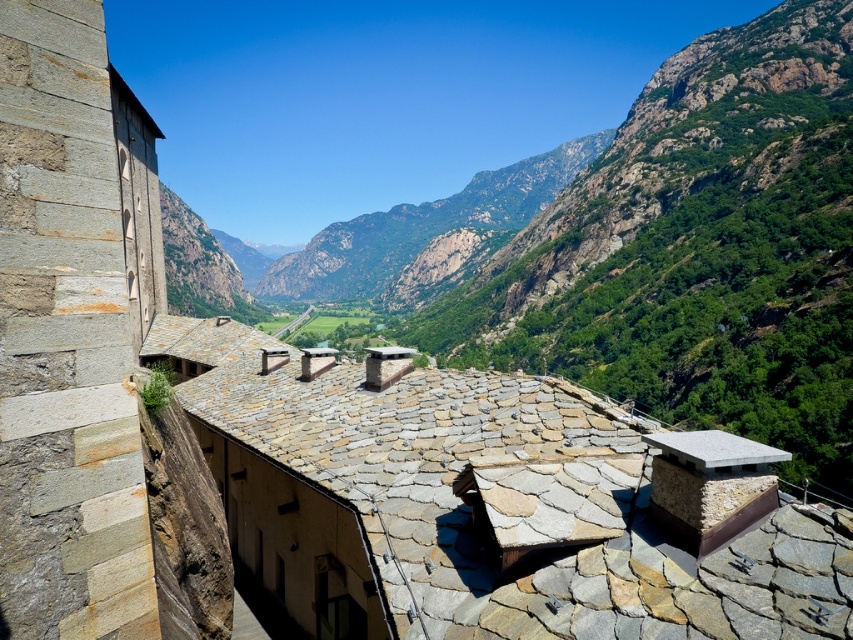
Does point (248, 522) lie in front of point (677, 509)?

No, (248, 522) is behind (677, 509).

Is point (326, 588) positioned in front of point (743, 458)?

No.

This screenshot has height=640, width=853. I want to click on gray stone roof at center, so click(x=469, y=506).

In the scene shown: Who is lower down, granite chimney at center or gray stone bench at lower right?

gray stone bench at lower right

Looking at this image, between granite chimney at center and gray stone bench at lower right, which one has more height?

With more height is granite chimney at center.

Consider the image. Who is more distant from viewer, (729, 481) or (766, 449)?

The point (766, 449) is behind.

Find the location of a particular element. The height and width of the screenshot is (640, 853). granite chimney at center is located at coordinates (711, 484).

Does point (448, 227) lie behind point (756, 470)?

Yes, it is.

Does green rocky mountain at center appear on the right side of gray stone bench at lower right?

No, green rocky mountain at center is not to the right of gray stone bench at lower right.

Which is behind, point (523, 193) or point (680, 442)?

The point (523, 193) is behind.

Locate an element on the screen. green rocky mountain at center is located at coordinates (421, 227).